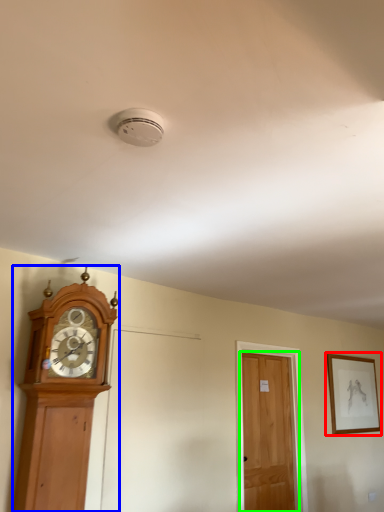
Question: Which object is positioned farthest from picture frame (highlighted by a red box)? Select from wall clock (highlighted by a blue box) and door (highlighted by a green box).

Choices:
 (A) wall clock
 (B) door

Answer: (A)